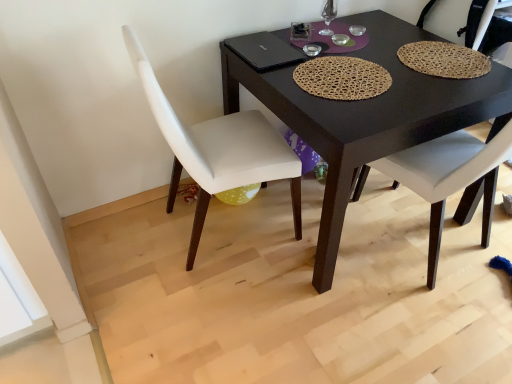
Question: Should I look upward or downward to see white leather chair at center, the 1th chair from the right?

Choices:
 (A) up
 (B) down

Answer: (A)

Question: Could you tell me if white leather chair at lower left, the 1th chair positioned from the left, is facing white leather chair at center, the 1th chair from the right?

Choices:
 (A) no
 (B) yes

Answer: (B)

Question: Would you say white leather chair at lower left, the 2th chair when ordered from right to left, contains white leather chair at center, the 1th chair from the right?

Choices:
 (A) no
 (B) yes

Answer: (A)

Question: From the image's perspective, is white leather chair at lower left, the 1th chair positioned from the left, on top of white leather chair at center, the 1th chair from the right?

Choices:
 (A) no
 (B) yes

Answer: (A)

Question: Considering the relative positions of white leather chair at lower left, the 1th chair positioned from the left, and white leather chair at center, the 1th chair from the right, in the image provided, is white leather chair at lower left, the 1th chair positioned from the left, behind white leather chair at center, the 1th chair from the right,?

Choices:
 (A) yes
 (B) no

Answer: (B)

Question: From a real-world perspective, does white leather chair at lower left, the 2th chair when ordered from right to left, stand above white leather chair at center, the 1th chair from the right?

Choices:
 (A) yes
 (B) no

Answer: (A)

Question: From a real-world perspective, is white leather chair at lower left, the 2th chair when ordered from right to left, under white leather chair at center, which ranks as the second chair in left-to-right order?

Choices:
 (A) yes
 (B) no

Answer: (B)

Question: Does black matte table at center have a larger size compared to white leather chair at lower left, the 2th chair when ordered from right to left?

Choices:
 (A) yes
 (B) no

Answer: (A)

Question: Does black matte table at center contain white leather chair at lower left, the 1th chair positioned from the left?

Choices:
 (A) yes
 (B) no

Answer: (B)

Question: Can you confirm if black matte table at center is shorter than white leather chair at lower left, the 1th chair positioned from the left?

Choices:
 (A) no
 (B) yes

Answer: (B)

Question: Is the position of black matte table at center less distant than that of white leather chair at lower left, the 2th chair when ordered from right to left?

Choices:
 (A) yes
 (B) no

Answer: (B)

Question: Could you tell me if black matte table at center is turned towards white leather chair at lower left, the 1th chair positioned from the left?

Choices:
 (A) yes
 (B) no

Answer: (B)

Question: Are black matte table at center and white leather chair at lower left, the 2th chair when ordered from right to left, located far from each other?

Choices:
 (A) yes
 (B) no

Answer: (B)

Question: Is the position of black matte table at center more distant than that of white leather chair at center, the 1th chair from the right?

Choices:
 (A) no
 (B) yes

Answer: (A)